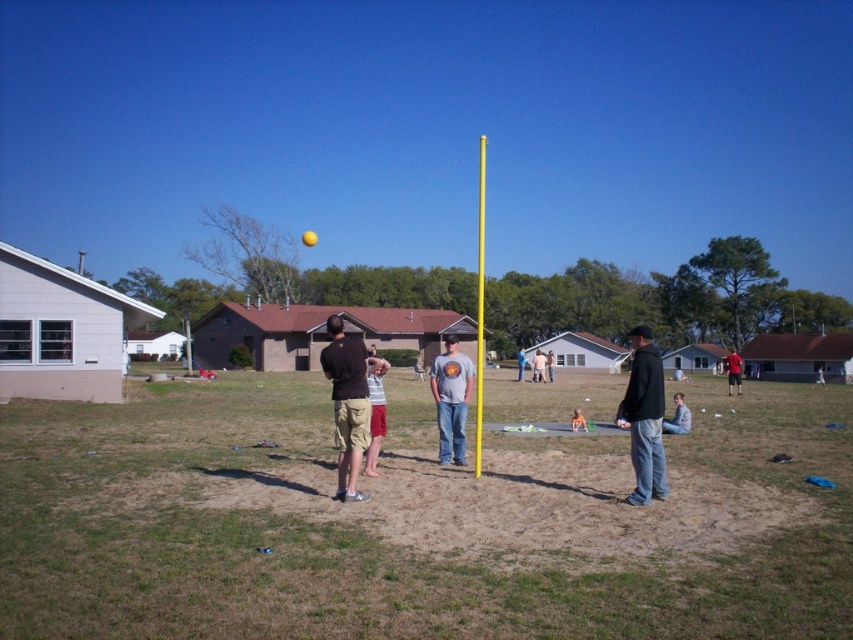
You are organizing a picnic and have brought a striped cotton shirt at center and a light brown wooden chair at center. Which item takes up more space?

The striped cotton shirt at center has a larger size compared to the light brown wooden chair at center, so the striped cotton shirt at center takes up more space.